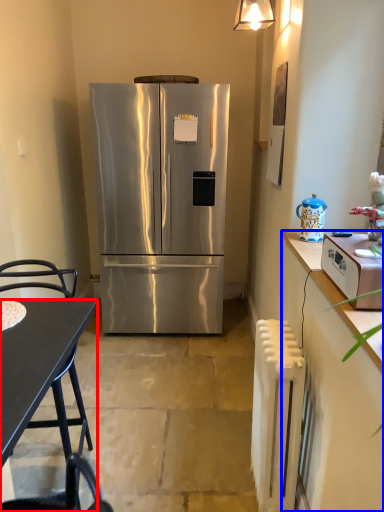
Question: Which of the following is the farthest to the observer, desk (highlighted by a red box) or cabinetry (highlighted by a blue box)?

Choices:
 (A) desk
 (B) cabinetry

Answer: (A)